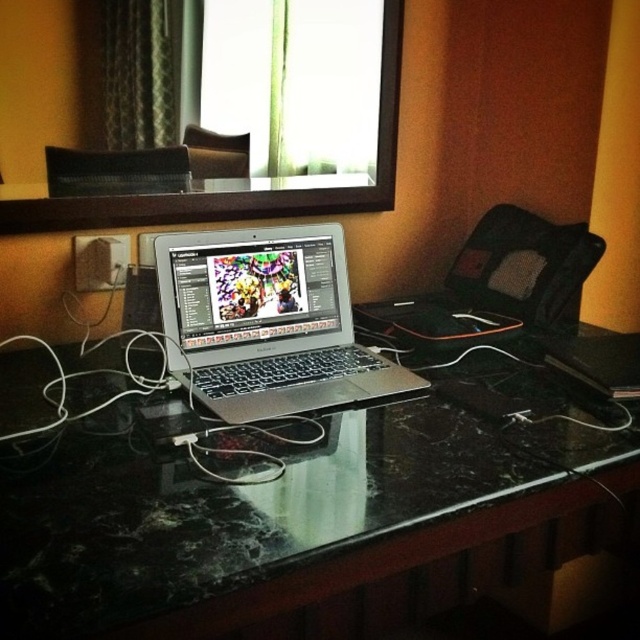
Does black marble computer desk at center appear over silver metallic laptop at center?

No.

Between black marble computer desk at center and silver metallic laptop at center, which one has less height?

silver metallic laptop at center

Which is in front, point (524, 426) or point (323, 312)?

Point (524, 426) is more forward.

The height and width of the screenshot is (640, 640). I want to click on black marble computer desk at center, so click(298, 520).